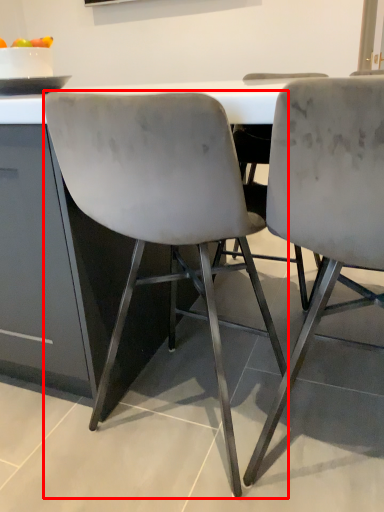
Question: Considering the relative positions of chair (annotated by the red box) and chair in the image provided, where is chair (annotated by the red box) located with respect to the staircase?

Choices:
 (A) left
 (B) right

Answer: (A)